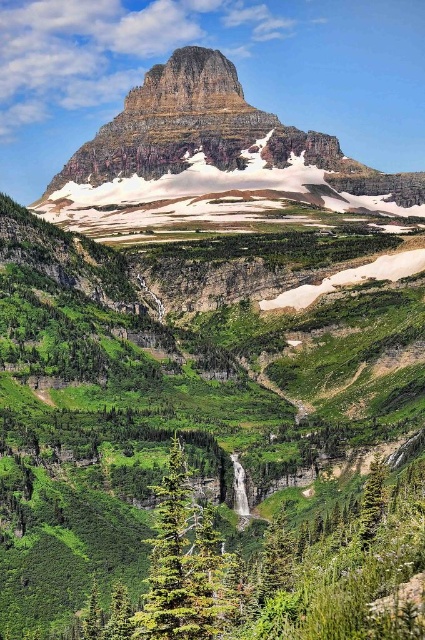
You are planning to set up a campsite in the valley between the rugged stone mountain at center and the green textured tree at center. Which object is wider, and therefore might require more space for the campsite?

The rugged stone mountain at center might be wider than the green textured tree at center, so it would require more space for the campsite.

You are standing at the point marked by point (193, 128) in the image. What type of terrain are you currently standing on?

You are standing on rugged stone mountain at center.

You are standing in the valley of the mountain landscape and want to reach the waterfall. You see two points marked on the image, point 1 at coordinates point (141, 132) and point 2 at coordinates point (209, 580). Which point is closer to you as you stand in the valley?

Point (141, 132) is closer to you than point (209, 580) because it is further to the viewer, meaning it is physically nearer in the scene.